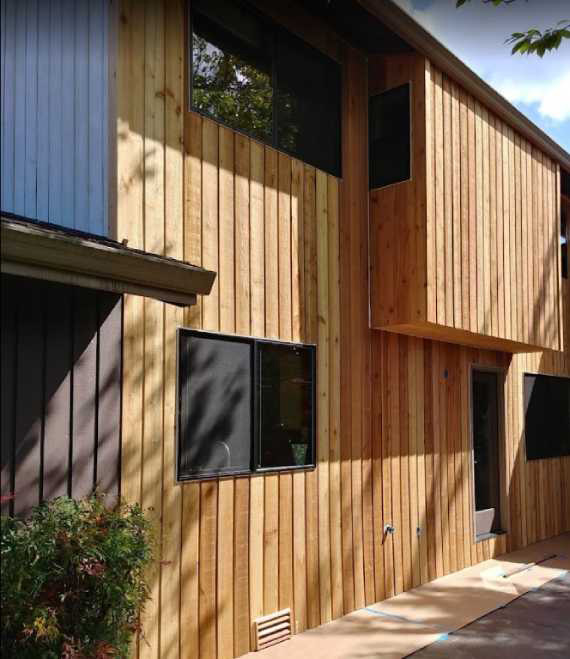
The width and height of the screenshot is (570, 659). I want to click on ledge, so click(162, 277).